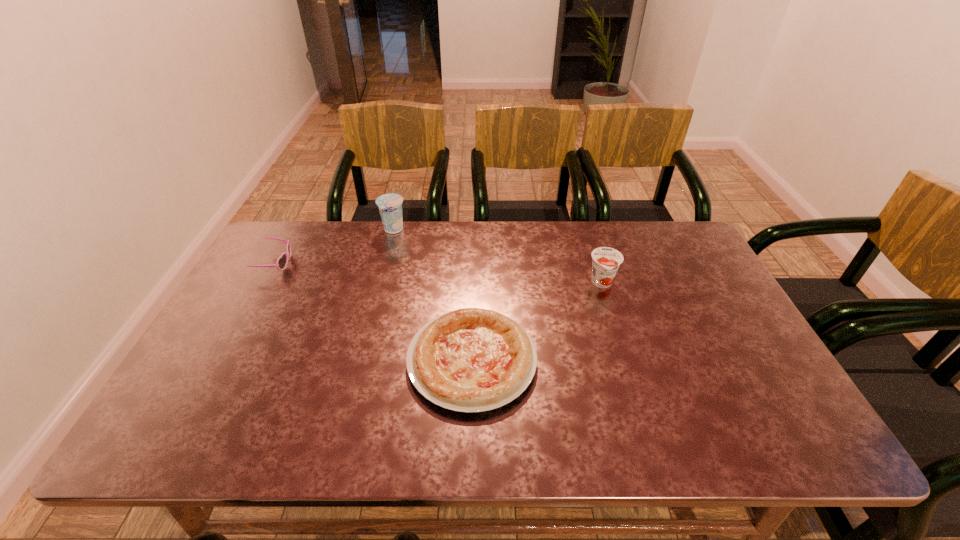
The width and height of the screenshot is (960, 540). What are the coordinates of `vacant space positioned on the left of the nearest object` in the screenshot? It's located at (368, 360).

Where is `yogurt situated at the far edge`? The image size is (960, 540). yogurt situated at the far edge is located at coordinates (390, 205).

The height and width of the screenshot is (540, 960). Identify the location of sunglasses present at the far edge. (281, 263).

This screenshot has height=540, width=960. I want to click on object that is at the near edge, so click(469, 360).

Where is `object positioned at the left edge`? object positioned at the left edge is located at coordinates (281, 263).

Where is `object present at the far left corner`? This screenshot has width=960, height=540. object present at the far left corner is located at coordinates (281, 263).

Find the location of a particular element. The height and width of the screenshot is (540, 960). vacant space at the far edge of the desktop is located at coordinates (425, 251).

You are a GUI agent. You are given a task and a screenshot of the screen. Output one action in this format:
    pyautogui.click(x=<x>, y=<y>)
    Task: Click on the vacant space at the near edge of the desktop
    This screenshot has width=960, height=540.
    Given the screenshot: What is the action you would take?
    click(686, 448)

The height and width of the screenshot is (540, 960). In order to click on free space at the left edge in this screenshot , I will do `click(272, 325)`.

In the image, there is a desktop. Where is `blank space at the right edge`? blank space at the right edge is located at coordinates (737, 314).